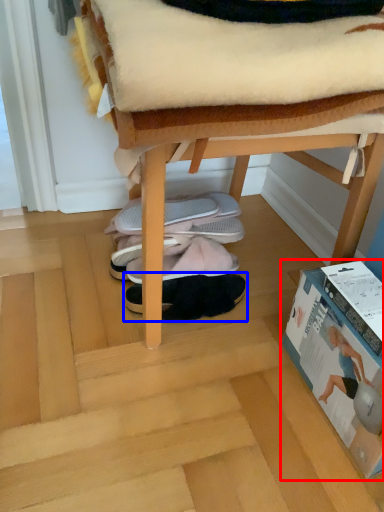
Question: Which point is closer to the camera, paperback book (highlighted by a red box) or footwear (highlighted by a blue box)?

Choices:
 (A) paperback book
 (B) footwear

Answer: (A)